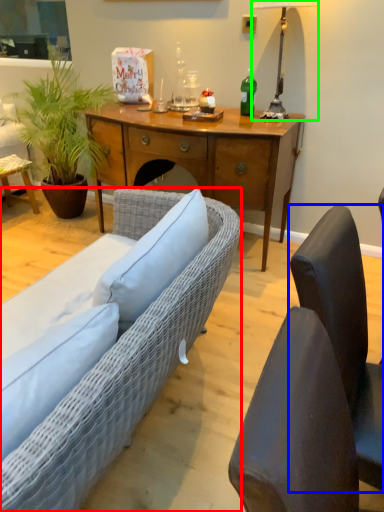
Question: Which object is the farthest from studio couch (highlighted by a red box)? Choose among these: chair (highlighted by a blue box) or lamp (highlighted by a green box).

Choices:
 (A) chair
 (B) lamp

Answer: (B)